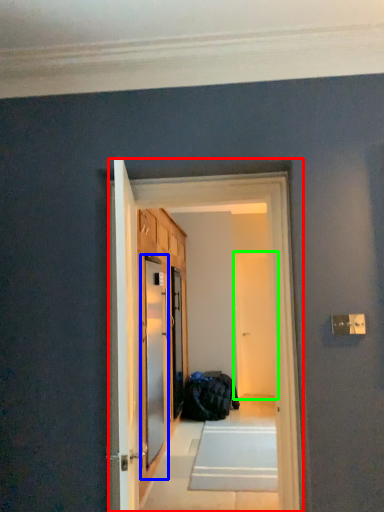
Question: Which object is the farthest from corridor (highlighted by a red box)? Choose among these: screen door (highlighted by a blue box) or screen door (highlighted by a green box).

Choices:
 (A) screen door
 (B) screen door

Answer: (B)